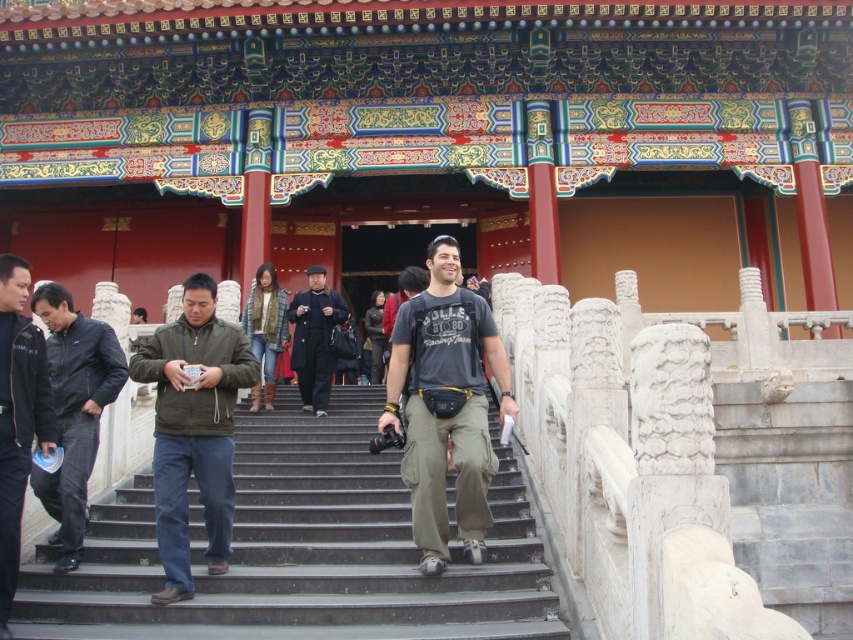
Question: Is dark green jacket at center thinner than denim jacket at center?

Choices:
 (A) no
 (B) yes

Answer: (A)

Question: Which of these objects is positioned farthest from the dark green jacket at center?

Choices:
 (A) dark blue wool coat at center
 (B) smooth concrete stairs at center
 (C) dark brown leather jacket at center

Answer: (C)

Question: Can you confirm if dark green jacket at center is positioned to the left of denim jacket at center?

Choices:
 (A) no
 (B) yes

Answer: (B)

Question: Can you confirm if dark green jacket at center is bigger than dark brown leather jacket at center?

Choices:
 (A) no
 (B) yes

Answer: (B)

Question: Which of these objects is positioned closest to the denim jacket at center?

Choices:
 (A) dark blue jeans at left
 (B) smooth concrete stairs at center

Answer: (B)

Question: Estimate the real-world distances between objects in this image. Which object is closer to the black leather jacket at lower left?

Choices:
 (A) dark gray cotton t-shirt at center
 (B) dark blue wool coat at center
 (C) dark blue jeans at left

Answer: (C)